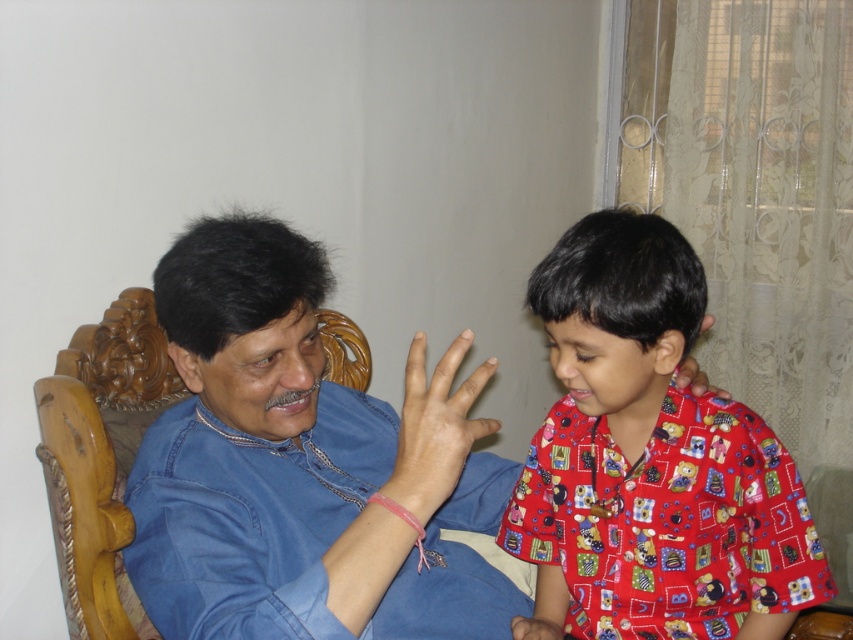
Is printed cotton shirt at right below smooth skin hand at center?

Yes, printed cotton shirt at right is below smooth skin hand at center.

You are a GUI agent. You are given a task and a screenshot of the screen. Output one action in this format:
    pyautogui.click(x=<x>, y=<y>)
    Task: Click on the printed cotton shirt at right
    Image resolution: width=853 pixels, height=640 pixels.
    Given the screenshot: What is the action you would take?
    pyautogui.click(x=648, y=460)

From the picture: Measure the distance between blue denim shirt at center and smooth skin hand at center.

blue denim shirt at center is 5.80 inches away from smooth skin hand at center.

Can you confirm if blue denim shirt at center is wider than smooth skin hand at center?

Indeed, blue denim shirt at center has a greater width compared to smooth skin hand at center.

Is point (293, 627) behind point (437, 406)?

No, it is in front of (437, 406).

Find the location of a particular element. Image resolution: width=853 pixels, height=640 pixels. blue denim shirt at center is located at coordinates (303, 465).

Which is more to the left, blue denim shirt at center or printed cotton shirt at right?

Positioned to the left is blue denim shirt at center.

How far apart are blue denim shirt at center and printed cotton shirt at right?

A distance of 9.49 inches exists between blue denim shirt at center and printed cotton shirt at right.

Does point (271, 260) come in front of point (705, 435)?

That is True.

Locate an element on the screen. This screenshot has width=853, height=640. blue denim shirt at center is located at coordinates (303, 465).